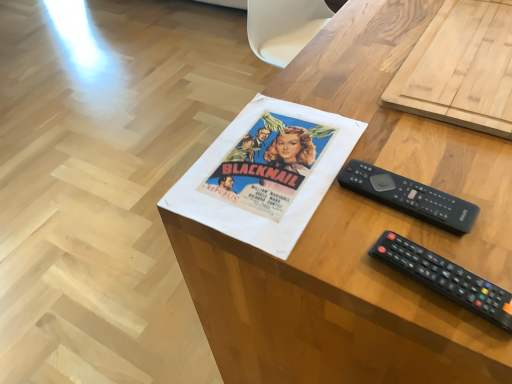
Where is `vacant space in front of black plastic remote at center right, the 1th remote control when ordered from back to front`? vacant space in front of black plastic remote at center right, the 1th remote control when ordered from back to front is located at coordinates (415, 275).